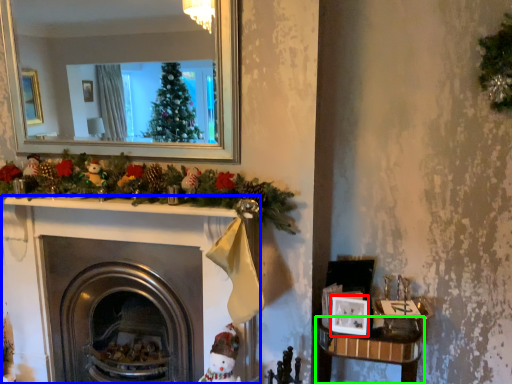
Question: Which object is the farthest from picture frame (highlighted by a red box)? Choose among these: fireplace (highlighted by a blue box) or table (highlighted by a green box).

Choices:
 (A) fireplace
 (B) table

Answer: (A)